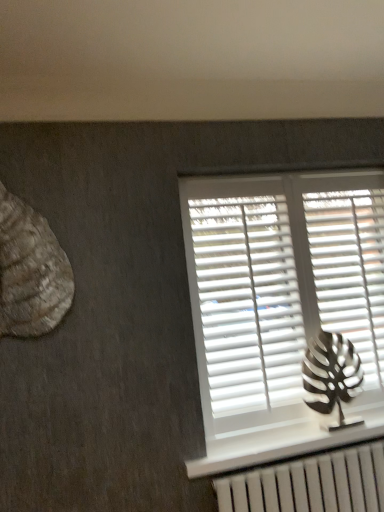
Question: Does white matte shutter at right, marked as the 2th shutter in a left-to-right arrangement, have a lesser height compared to white plastic shutters at center, which ranks as the 2th shutter in right-to-left order?

Choices:
 (A) no
 (B) yes

Answer: (B)

Question: Is white matte shutter at right, marked as the 2th shutter in a left-to-right arrangement, wider than white plastic shutters at center, which ranks as the 2th shutter in right-to-left order?

Choices:
 (A) yes
 (B) no

Answer: (A)

Question: Can you see white matte shutter at right, which is the first shutter in right-to-left order, touching white plastic shutters at center, which ranks as the 2th shutter in right-to-left order?

Choices:
 (A) no
 (B) yes

Answer: (A)

Question: From a real-world perspective, is white matte shutter at right, which is the first shutter in right-to-left order, under white plastic shutters at center, which ranks as the first shutter in left-to-right order?

Choices:
 (A) yes
 (B) no

Answer: (B)

Question: Does white matte shutter at right, which is the first shutter in right-to-left order, come behind white plastic shutters at center, which ranks as the first shutter in left-to-right order?

Choices:
 (A) yes
 (B) no

Answer: (A)

Question: Considering the relative sizes of white matte shutter at right, marked as the 2th shutter in a left-to-right arrangement, and white plastic shutters at center, which ranks as the 2th shutter in right-to-left order, in the image provided, is white matte shutter at right, marked as the 2th shutter in a left-to-right arrangement, taller than white plastic shutters at center, which ranks as the 2th shutter in right-to-left order,?

Choices:
 (A) no
 (B) yes

Answer: (A)

Question: From a real-world perspective, is white matte shutter at right, marked as the 2th shutter in a left-to-right arrangement, positioned over rustic wood seashell at left, the first animal from the top, based on gravity?

Choices:
 (A) yes
 (B) no

Answer: (B)

Question: From the image's perspective, does white matte shutter at right, which is the first shutter in right-to-left order, appear lower than rustic wood seashell at left, placed as the 1th animal when sorted from front to back?

Choices:
 (A) yes
 (B) no

Answer: (A)

Question: Is the position of white matte shutter at right, which is the first shutter in right-to-left order, less distant than that of rustic wood seashell at left, the first animal from the top?

Choices:
 (A) no
 (B) yes

Answer: (A)

Question: Considering the relative sizes of white matte shutter at right, marked as the 2th shutter in a left-to-right arrangement, and rustic wood seashell at left, placed as the 1th animal when sorted from front to back, in the image provided, is white matte shutter at right, marked as the 2th shutter in a left-to-right arrangement, taller than rustic wood seashell at left, placed as the 1th animal when sorted from front to back,?

Choices:
 (A) no
 (B) yes

Answer: (B)

Question: Is white matte shutter at right, which is the first shutter in right-to-left order, aimed at rustic wood seashell at left, the second animal positioned from the back?

Choices:
 (A) no
 (B) yes

Answer: (A)

Question: Does white matte shutter at right, which is the first shutter in right-to-left order, have a lesser height compared to rustic wood seashell at left, placed as the 1th animal when sorted from front to back?

Choices:
 (A) no
 (B) yes

Answer: (A)

Question: From a real-world perspective, is white matte blinds at upper right physically above metallic silver leaf at right, placed as the first animal when sorted from right to left?

Choices:
 (A) no
 (B) yes

Answer: (B)